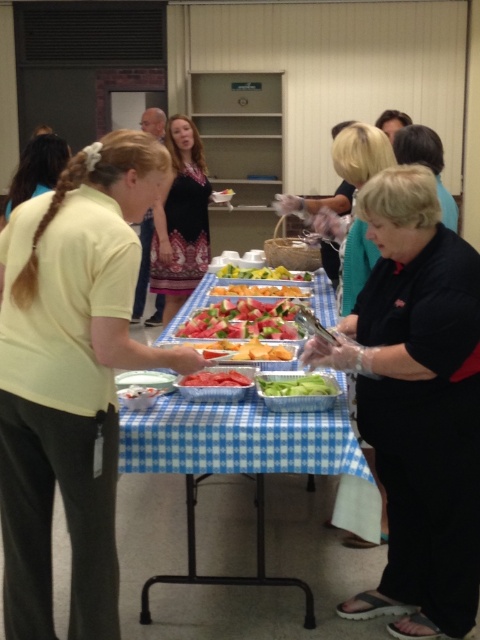
Question: Does sliced watermelon at center have a smaller size compared to green leafy vegetables at center?

Choices:
 (A) no
 (B) yes

Answer: (A)

Question: Can you confirm if green matte celery at center is thinner than green leafy vegetables at center?

Choices:
 (A) no
 (B) yes

Answer: (B)

Question: Estimate the real-world distances between objects in this image. Which object is closer to the yellow matte shirt at left?

Choices:
 (A) red matte watermelon at center
 (B) blue checkered tablecloth at center
 (C) white plastic container at center

Answer: (C)

Question: Does black matte shirt at center appear on the right side of sliced watermelon at center?

Choices:
 (A) no
 (B) yes

Answer: (B)

Question: Which point is farther to the camera?

Choices:
 (A) patterned fabric dress at center
 (B) sliced watermelon at center

Answer: (A)

Question: Which of the following is the farthest from the observer?

Choices:
 (A) (213, 381)
 (B) (298, 388)
 (C) (254, 278)
 (D) (10, 204)

Answer: (C)